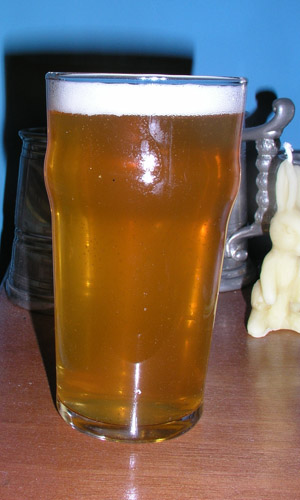
I want to click on candlewick, so click(x=291, y=151).